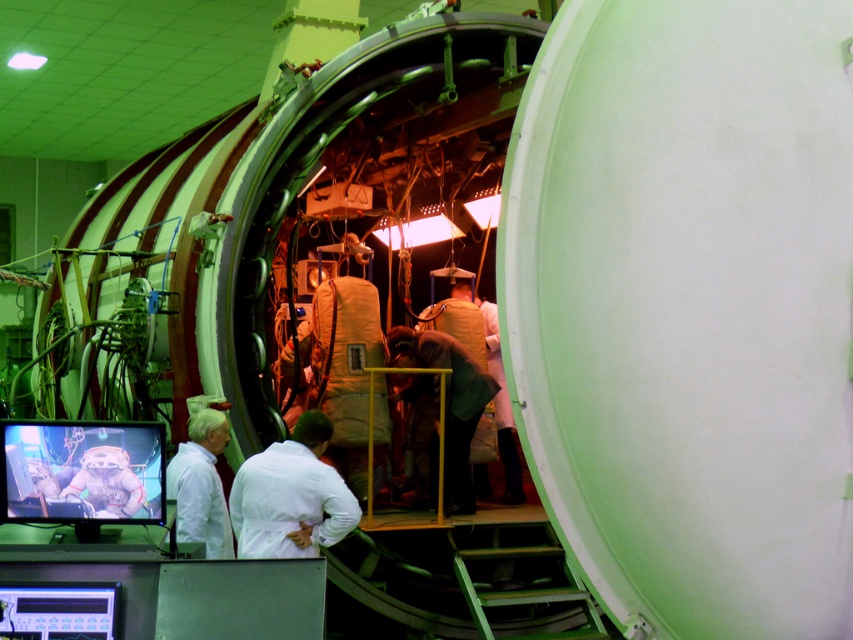
Question: Which object appears farthest from the camera in this image?

Choices:
 (A) white matte lab coat at center
 (B) khaki fabric suit at center

Answer: (B)

Question: Is white matte lab coat at center closer to camera compared to khaki fabric suit at center?

Choices:
 (A) no
 (B) yes

Answer: (B)

Question: Among these points, which one is nearest to the camera?

Choices:
 (A) (421, 349)
 (B) (252, 508)

Answer: (B)

Question: Is white matte lab coat at center to the right of khaki fabric suit at center from the viewer's perspective?

Choices:
 (A) no
 (B) yes

Answer: (A)

Question: Can you confirm if white matte lab coat at center is positioned to the right of khaki fabric suit at center?

Choices:
 (A) yes
 (B) no

Answer: (B)